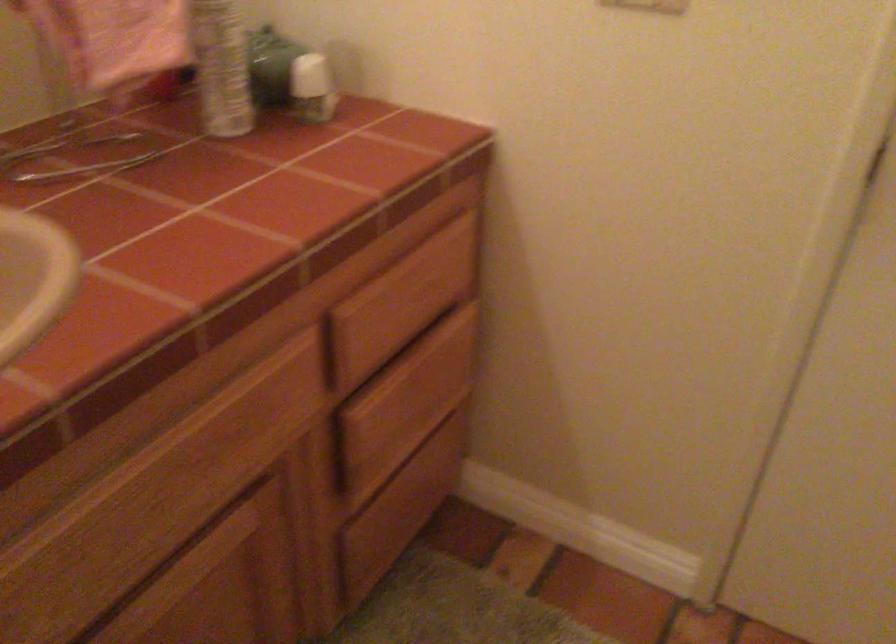
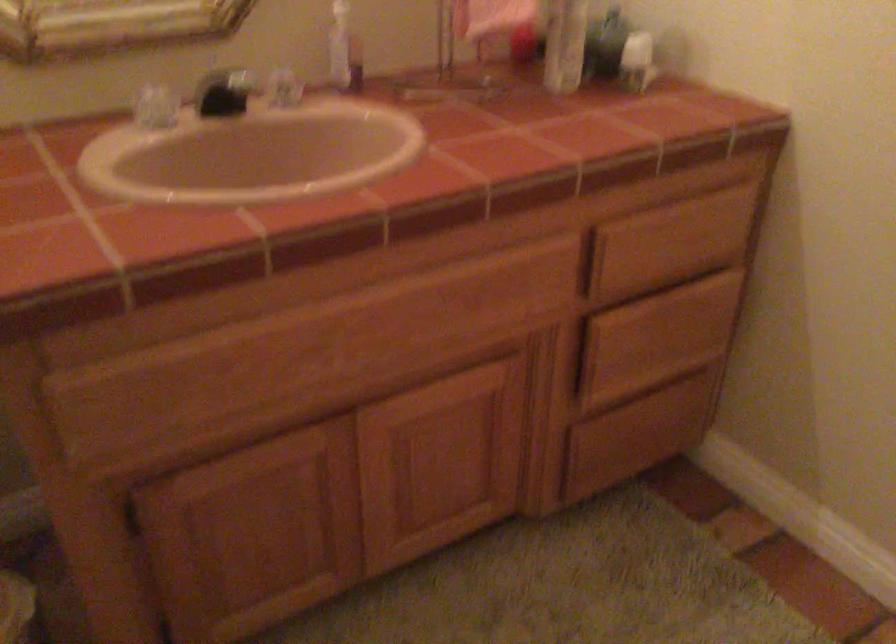
Which direction would the cameraman need to move to produce the second image?

The cameraman walked toward right, backward.